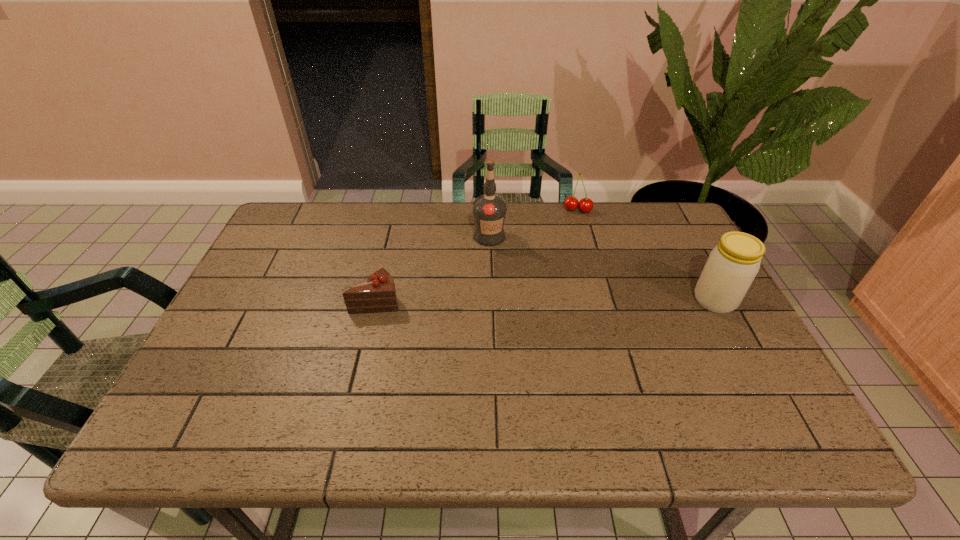
The image size is (960, 540). I want to click on vacant space located with the stems of the cherry pointing upwards, so click(569, 258).

Locate an element on the screen. This screenshot has height=540, width=960. vacant area located 0.380m with the stems of the cherry pointing upwards is located at coordinates (564, 296).

You are a GUI agent. You are given a task and a screenshot of the screen. Output one action in this format:
    pyautogui.click(x=<x>, y=<y>)
    Task: Click on the free space located 0.400m with the stems of the cherry pointing upwards
    
    Given the screenshot: What is the action you would take?
    pyautogui.click(x=564, y=302)

Find the location of `free space located 0.350m on the front label of the third nearest object`. free space located 0.350m on the front label of the third nearest object is located at coordinates (575, 320).

The height and width of the screenshot is (540, 960). In order to click on vacant space situated on the front label of the third nearest object in this screenshot , I will do `click(573, 317)`.

Identify the location of blank space located on the front label of the third nearest object. (526, 272).

You are a GUI agent. You are given a task and a screenshot of the screen. Output one action in this format:
    pyautogui.click(x=<x>, y=<y>)
    Task: Click on the cherry positioned at the far edge
    The width and height of the screenshot is (960, 540).
    Given the screenshot: What is the action you would take?
    pyautogui.click(x=571, y=203)

Where is `vodka at the far edge`? The width and height of the screenshot is (960, 540). vodka at the far edge is located at coordinates (489, 210).

What are the coordinates of `object situated at the right edge` in the screenshot? It's located at (732, 265).

Where is `vacant space at the far edge`? vacant space at the far edge is located at coordinates (433, 239).